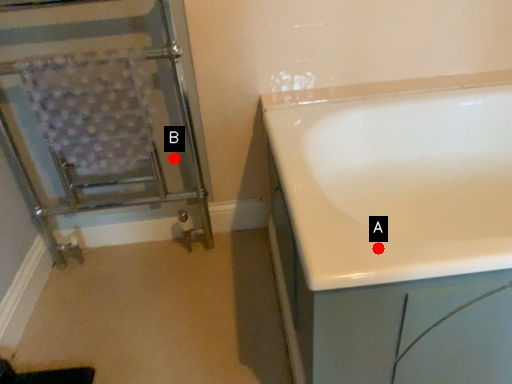
Question: Two points are circled on the image, labeled by A and B beside each circle. Which point appears farthest from the camera in this image?

Choices:
 (A) A is further
 (B) B is further

Answer: (B)